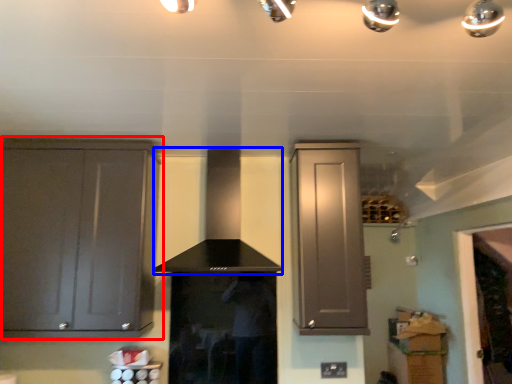
Question: Which of the following is the farthest to the observer, cabinetry (highlighted by a red box) or vent (highlighted by a blue box)?

Choices:
 (A) cabinetry
 (B) vent

Answer: (A)